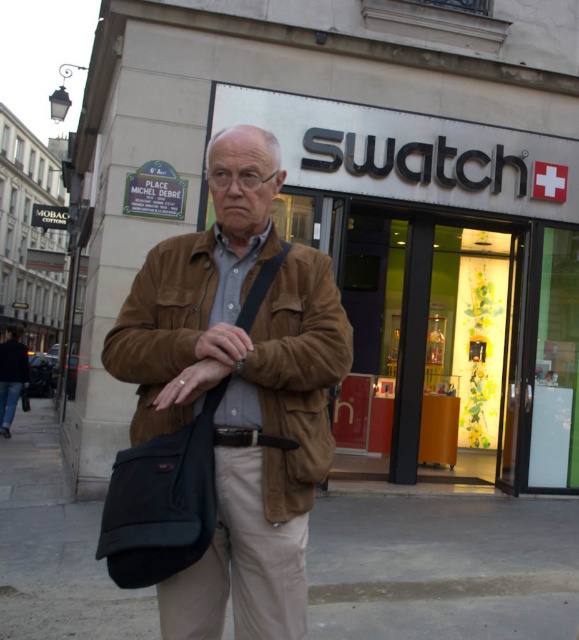
You are a photographer taking a picture of the Swatch store. The man in the scene is blocking your view of the store entrance. Which object should you focus on to ensure the brown fabric bag at center is visible while the brown suede jacket at center is not?

You should focus on the brown fabric bag at center by adjusting your camera angle so that the brown suede jacket at center, which is in front of it, is moved out of the frame. This way, the brown fabric bag at center will be visible while the brown suede jacket at center is not.

You are a delivery person who needs to place a package on a shelf that can hold items up to 1.5 meters in height. You see the matte brown leather store at center and the brown fabric bag at center. Which object can be placed on the shelf?

The brown fabric bag at center can be placed on the shelf since it is shorter than the 1.5 meters height limit, while the matte brown leather store at center is taller and cannot be placed there.